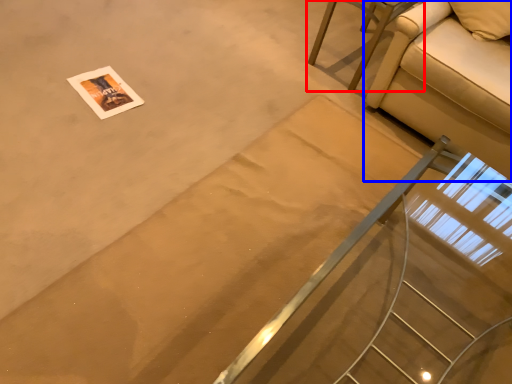
Question: Which point is further to the camera, furniture (highlighted by a red box) or studio couch (highlighted by a blue box)?

Choices:
 (A) furniture
 (B) studio couch

Answer: (A)